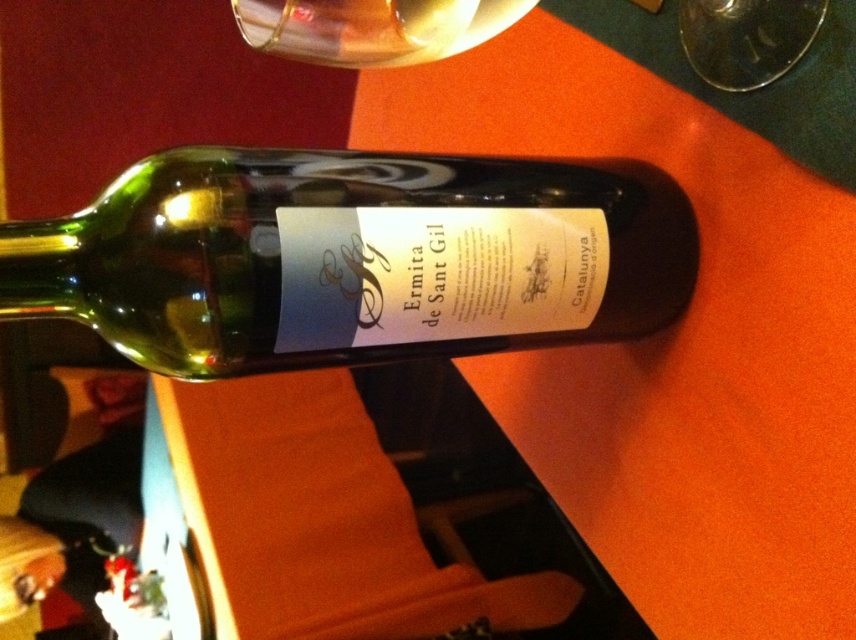
Does orange matte table at center have a greater height compared to transparent glass at upper center?

Correct, orange matte table at center is much taller as transparent glass at upper center.

This screenshot has height=640, width=856. In order to click on orange matte table at center in this screenshot , I will do `click(673, 342)`.

In the scene shown: Which of these two, green glass bottle at center or transparent glass at upper right, stands shorter?

With less height is transparent glass at upper right.

What are the coordinates of `green glass bottle at center` in the screenshot? It's located at (354, 257).

Is transparent glass at upper center thinner than transparent glass at upper right?

In fact, transparent glass at upper center might be wider than transparent glass at upper right.

Who is lower down, transparent glass at upper center or transparent glass at upper right?

transparent glass at upper right is below.

Who is more forward, (x=272, y=44) or (x=709, y=68)?

Positioned in front is point (x=272, y=44).

Find the location of a particular element. transparent glass at upper center is located at coordinates (372, 28).